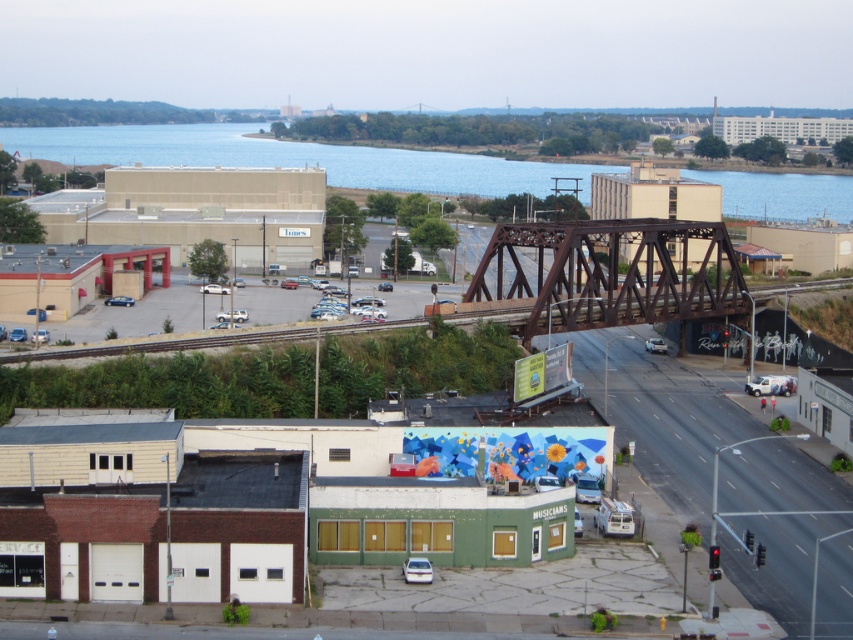
Question: Is brown metal bridge at center smaller than brown metal train track at center?

Choices:
 (A) yes
 (B) no

Answer: (A)

Question: Which point appears farthest from the camera in this image?

Choices:
 (A) (396, 316)
 (B) (120, 301)

Answer: (B)

Question: Which point is closer to the camera?

Choices:
 (A) (106, 157)
 (B) (225, 291)

Answer: (B)

Question: Can you confirm if brown metal train track at center is positioned to the right of white matte car at center?

Choices:
 (A) no
 (B) yes

Answer: (B)

Question: Does brown metal train track at center appear on the right side of white matte car at center?

Choices:
 (A) no
 (B) yes

Answer: (B)

Question: Among these objects, which one is farthest from the camera?

Choices:
 (A) brown metal bridge at center
 (B) silver metallic sedan at center
 (C) white matte car at center

Answer: (B)